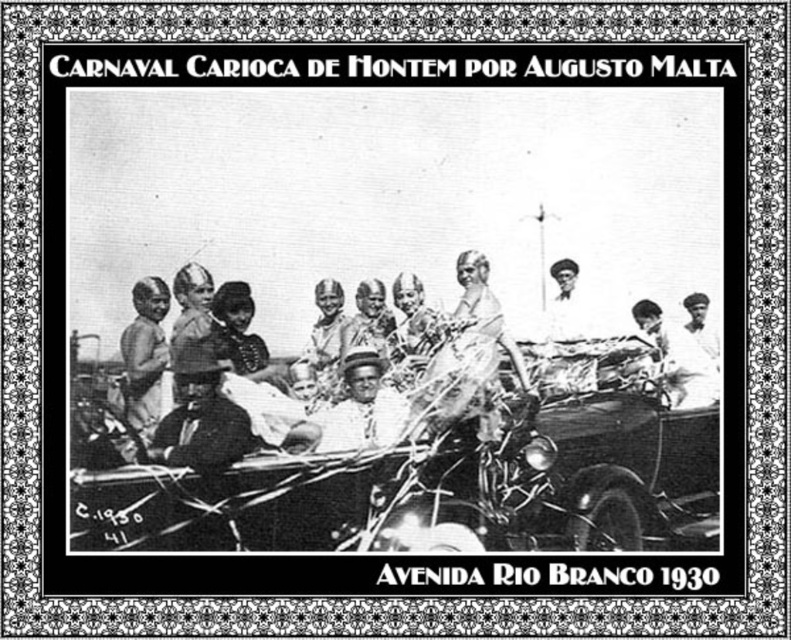
You are a photographer analyzing this 1930 carnival photo. You notice two figures in the vehicle. The first is wearing a smooth black suit at center, and the second has light brown skin at left. Based on their sizes in the photo, which figure appears closer to the camera?

The smooth black suit at center has a smaller size compared to light brown skin at left, so the light brown skin at left appears closer to the camera because objects closer to the camera appear larger in the photo.

You are standing in front of the carnival photograph and notice two points marked in the scene. Which point, point [366,396] or point [157,288], is closer to you?

Point [366,396] is closer to the viewer than point [157,288].

You are a photographer standing in front of the framed black and white photograph of the 1930 carnival parade on Avenida Rio Branco. You notice the shiny chrome car at center and the light brown skin at left. Which object is positioned closer to you?

The shiny chrome car at center is closer to the viewer than the light brown skin at left.